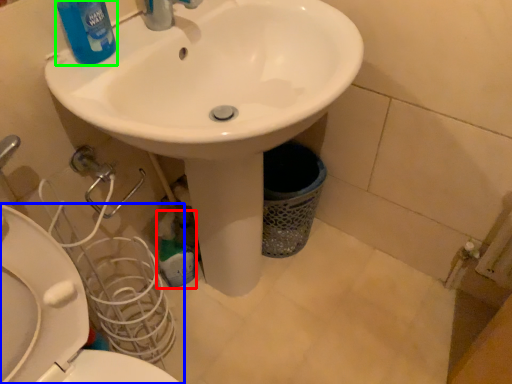
Question: Based on their relative distances, which object is farther from cleaning product (highlighted by a red box)? Choose from toilet (highlighted by a blue box) and cleaning product (highlighted by a green box).

Choices:
 (A) toilet
 (B) cleaning product

Answer: (B)